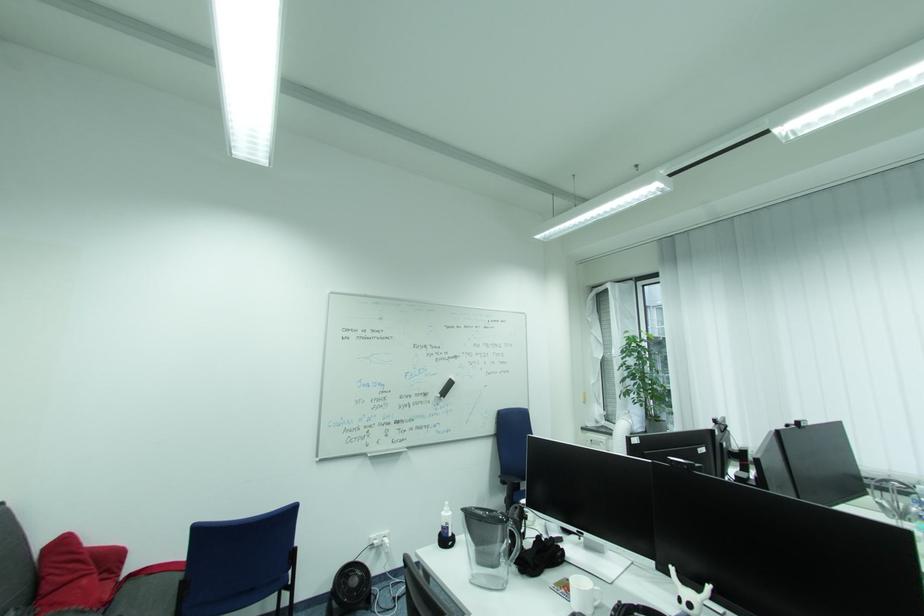
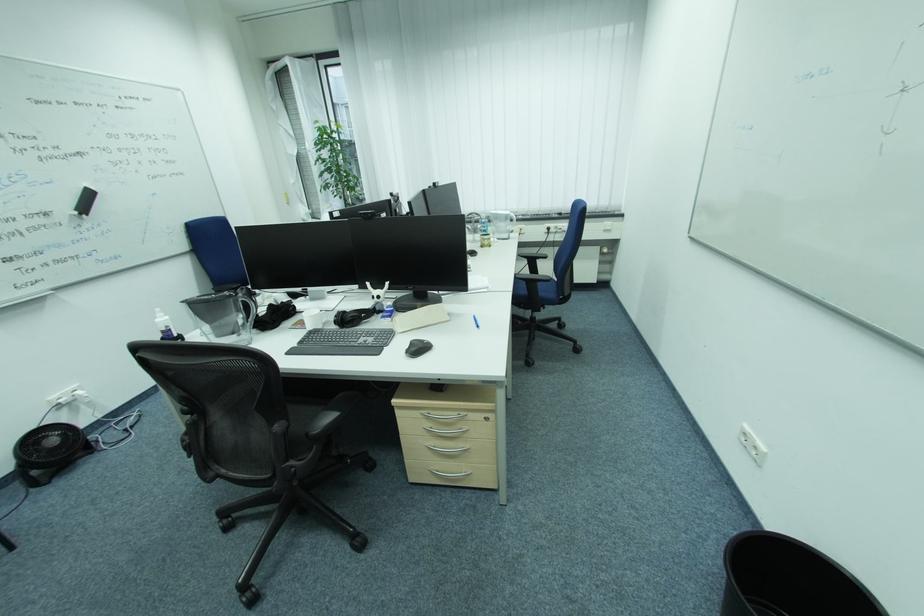
Where in the second image is the point corresponding to [361,582] from the first image?

(59, 442)